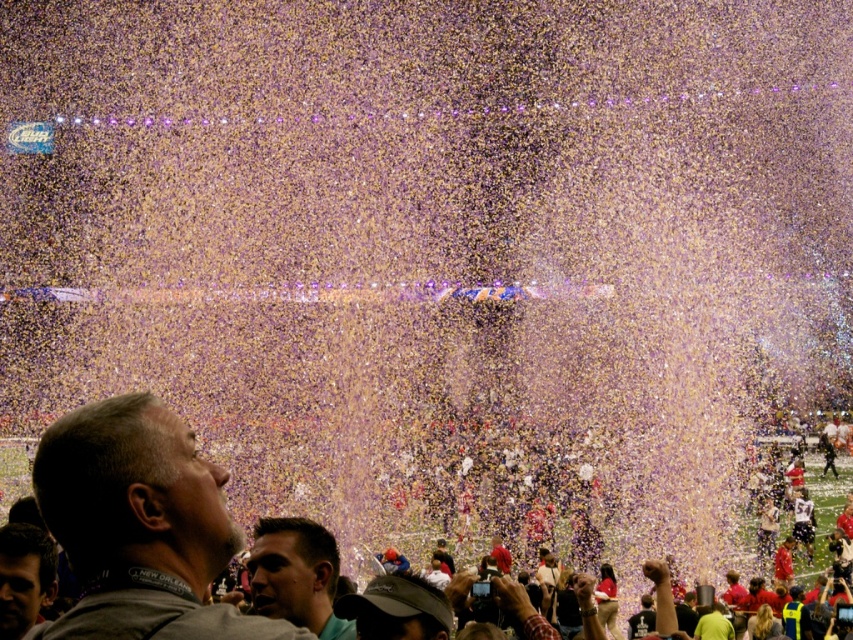
Based on the photo, you are standing at the position of the gray fabric shirt at lower left and want to take a photo of the confetti shower. Is the camera within a 50 meter range from you?

The distance between the gray fabric shirt at lower left and the camera is 58.50 meters, so the camera is outside the 50 meter range.

You are a photographer at the event and want to take a photo of the smooth skin face at lower left and the green matte shirt at lower center. Based on their positions, which one should you focus on first to ensure both are in the frame?

You should focus on the smooth skin face at lower left first because the green matte shirt at lower center is to the right of it, so adjusting the frame to include both would require starting from the left side.